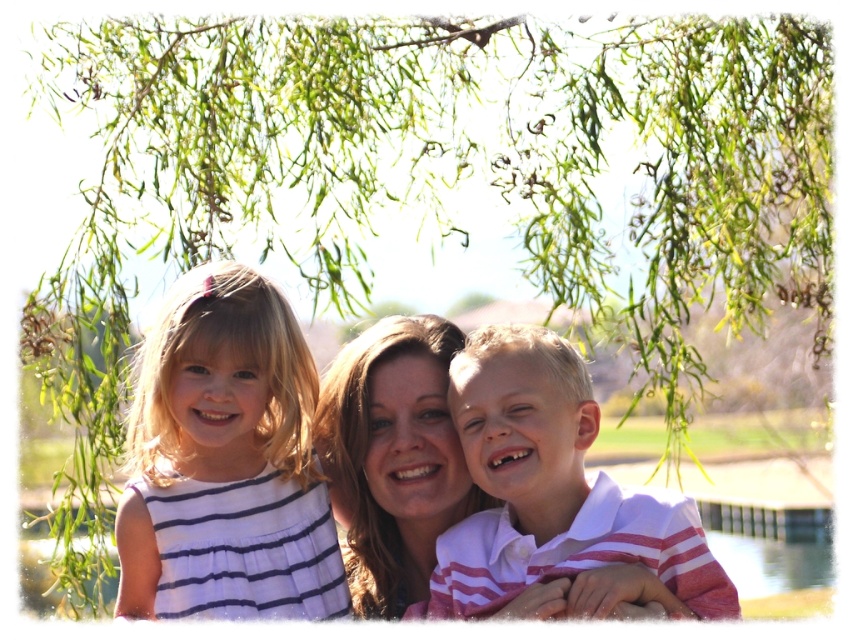
Does white striped dress at left come behind white striped shirt at center?

Yes, it is.

Which is more to the left, white striped dress at left or white striped shirt at center?

white striped dress at left is more to the left.

At what (x,y) coordinates should I click in order to perform the action: click on white striped dress at left. Please return your answer as a coordinate pair (x, y). Looking at the image, I should click on (225, 461).